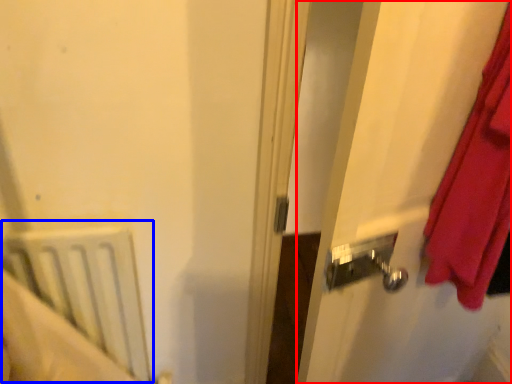
Question: Which object appears closest to the camera in this image, screen door (highlighted by a red box) or radiator (highlighted by a blue box)?

Choices:
 (A) screen door
 (B) radiator

Answer: (A)